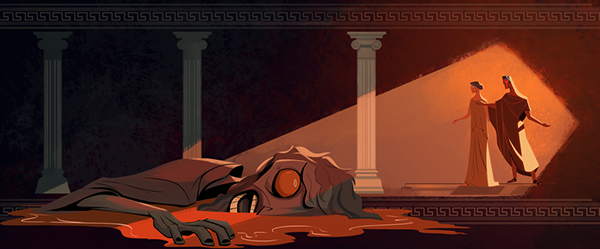
Where is `robe`? robe is located at coordinates (478, 115), (514, 113).